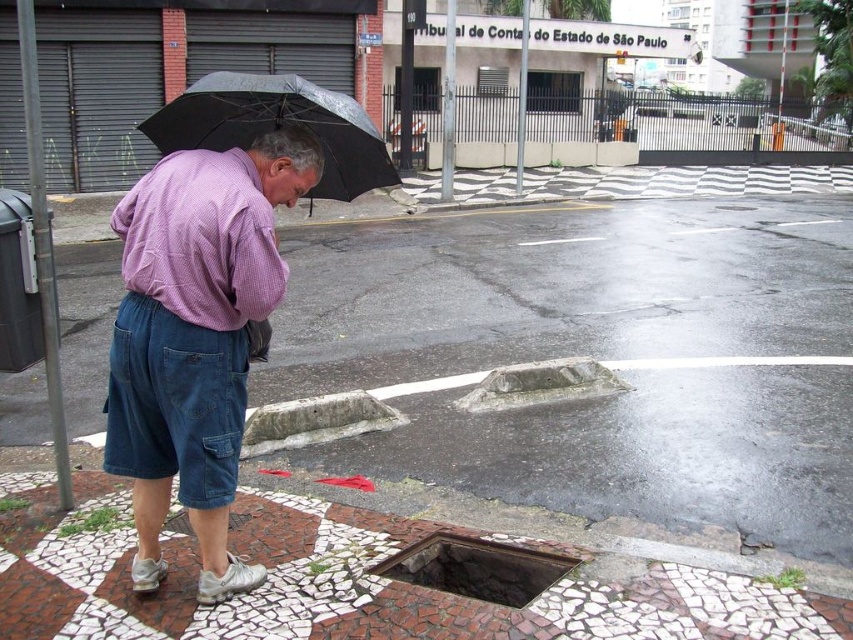
Does black matte umbrella at upper left appear under rusty metal manhole at lower center?

Incorrect, black matte umbrella at upper left is not positioned below rusty metal manhole at lower center.

Between black matte umbrella at upper left and rusty metal manhole at lower center, which one is positioned higher?

Positioned higher is black matte umbrella at upper left.

Identify the location of black matte umbrella at upper left. Image resolution: width=853 pixels, height=640 pixels. (277, 125).

The image size is (853, 640). I want to click on black matte umbrella at upper left, so click(277, 125).

Looking at this image, does white mosaic pavement at lower center have a smaller size compared to black matte umbrella at upper left?

Actually, white mosaic pavement at lower center might be larger than black matte umbrella at upper left.

Is white mosaic pavement at lower center positioned before black matte umbrella at upper left?

No, white mosaic pavement at lower center is behind black matte umbrella at upper left.

The width and height of the screenshot is (853, 640). I want to click on white mosaic pavement at lower center, so click(x=598, y=356).

Where is `white mosaic pavement at lower center`? The width and height of the screenshot is (853, 640). white mosaic pavement at lower center is located at coordinates (598, 356).

Does purple woven shirt at center have a greater width compared to rusty metal manhole at lower center?

No, purple woven shirt at center is not wider than rusty metal manhole at lower center.

Locate an element on the screen. The width and height of the screenshot is (853, 640). purple woven shirt at center is located at coordinates (195, 337).